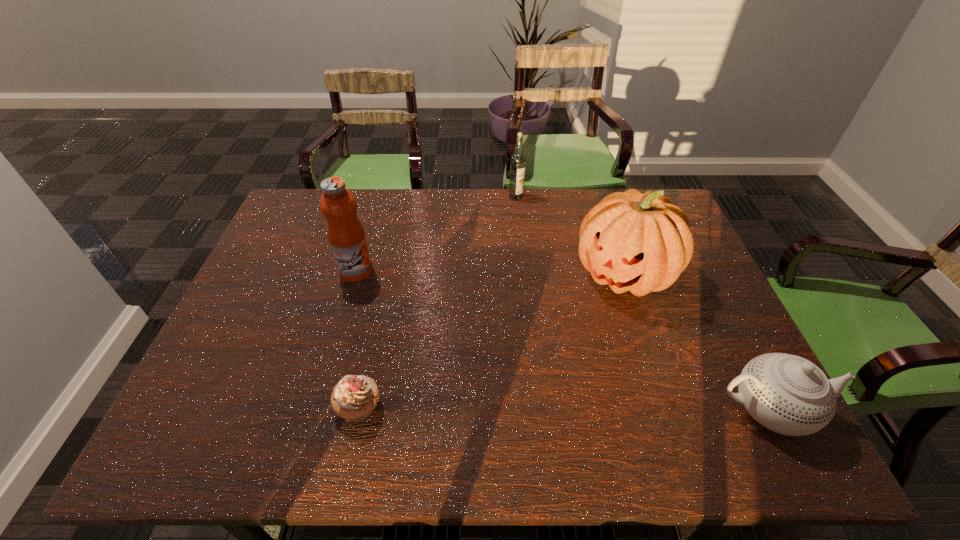
At what (x,y) coordinates should I click in order to perform the action: click on cupcake. Please return your answer as a coordinate pair (x, y). Image resolution: width=960 pixels, height=540 pixels. Looking at the image, I should click on (354, 398).

Where is `chinaware`? This screenshot has height=540, width=960. chinaware is located at coordinates (787, 394).

Identify the location of fruit juice. (346, 235).

Where is `the farthest object`? the farthest object is located at coordinates (518, 160).

The width and height of the screenshot is (960, 540). Identify the location of vodka. (518, 160).

Where is `pumpkin`? pumpkin is located at coordinates (639, 242).

Where is `free region located 0.160m on the back of the shortest object`? This screenshot has height=540, width=960. free region located 0.160m on the back of the shortest object is located at coordinates (375, 331).

The height and width of the screenshot is (540, 960). I want to click on vacant space located on the front label of the fruit juice, so click(x=424, y=335).

The height and width of the screenshot is (540, 960). I want to click on free spot located on the front label of the fruit juice, so click(x=458, y=366).

Where is `free space located on the front label of the fruit juice`? The height and width of the screenshot is (540, 960). free space located on the front label of the fruit juice is located at coordinates (444, 354).